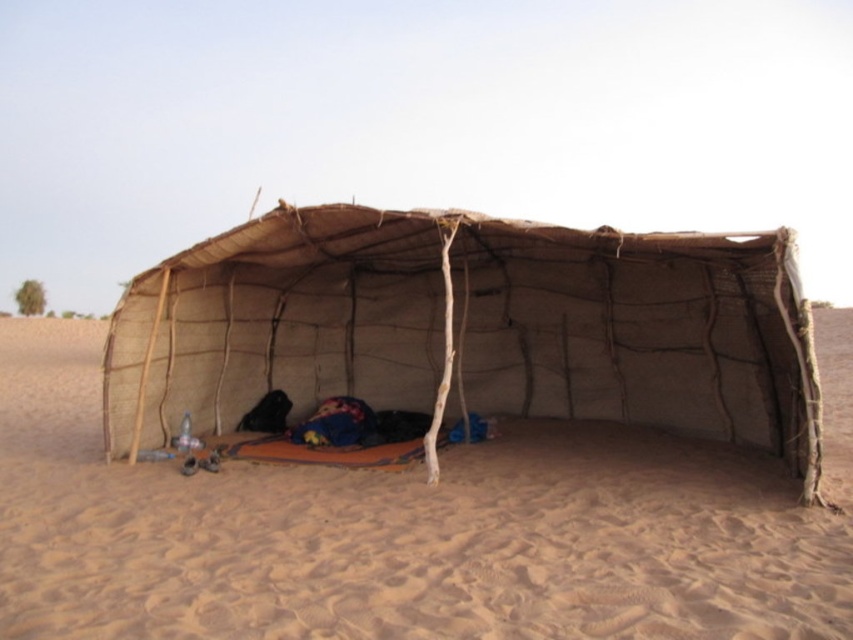
Question: Is brown sandy ground at center closer to the viewer compared to natural woven fabric tent at center?

Choices:
 (A) yes
 (B) no

Answer: (A)

Question: In this image, where is brown sandy ground at center located relative to natural woven fabric tent at center?

Choices:
 (A) left
 (B) right

Answer: (B)

Question: Among these objects, which one is farthest from the camera?

Choices:
 (A) brown sandy ground at center
 (B) natural woven fabric tent at center

Answer: (B)

Question: Which object is closer to the camera taking this photo?

Choices:
 (A) brown sandy ground at center
 (B) natural woven fabric tent at center

Answer: (A)

Question: Which point is farther to the camera?

Choices:
 (A) brown sandy ground at center
 (B) natural woven fabric tent at center

Answer: (B)

Question: Does brown sandy ground at center appear under natural woven fabric tent at center?

Choices:
 (A) yes
 (B) no

Answer: (A)